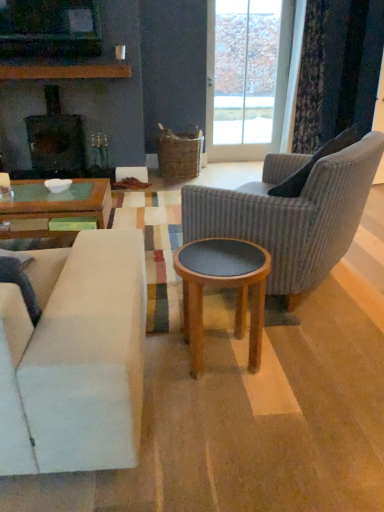
Question: From the image's perspective, is dark gray fabric pillow at right on top of matte black fireplace at center?

Choices:
 (A) no
 (B) yes

Answer: (A)

Question: Is dark gray fabric pillow at right behind matte black fireplace at center?

Choices:
 (A) no
 (B) yes

Answer: (A)

Question: Would you say dark gray fabric pillow at right contains matte black fireplace at center?

Choices:
 (A) yes
 (B) no

Answer: (B)

Question: Does dark gray fabric pillow at right have a larger size compared to matte black fireplace at center?

Choices:
 (A) yes
 (B) no

Answer: (B)

Question: From a real-world perspective, is dark gray fabric pillow at right over matte black fireplace at center?

Choices:
 (A) no
 (B) yes

Answer: (B)

Question: Is dark gray fabric pillow at right positioned far away from matte black fireplace at center?

Choices:
 (A) yes
 (B) no

Answer: (A)

Question: From the image's perspective, is matte black fireplace at center beneath velvet dark blue curtain at upper right?

Choices:
 (A) yes
 (B) no

Answer: (A)

Question: Considering the relative sizes of matte black fireplace at center and velvet dark blue curtain at upper right in the image provided, is matte black fireplace at center shorter than velvet dark blue curtain at upper right?

Choices:
 (A) no
 (B) yes

Answer: (B)

Question: Is matte black fireplace at center placed right next to velvet dark blue curtain at upper right?

Choices:
 (A) yes
 (B) no

Answer: (B)

Question: Is there a large distance between matte black fireplace at center and velvet dark blue curtain at upper right?

Choices:
 (A) yes
 (B) no

Answer: (A)

Question: Does matte black fireplace at center have a larger size compared to velvet dark blue curtain at upper right?

Choices:
 (A) yes
 (B) no

Answer: (A)

Question: Is matte black fireplace at center taller than velvet dark blue curtain at upper right?

Choices:
 (A) no
 (B) yes

Answer: (A)

Question: Is white fabric couch at left at the left side of white glossy bowl at center?

Choices:
 (A) yes
 (B) no

Answer: (B)